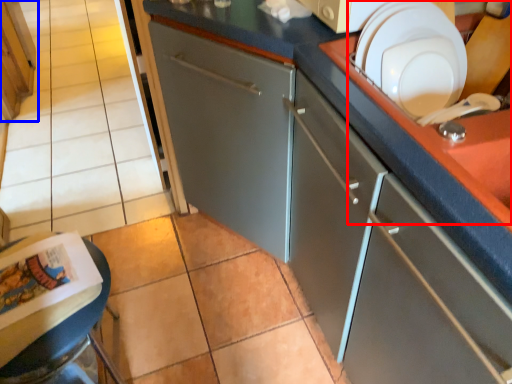
Question: Which point is closer to the camera, sink (highlighted by a red box) or cabinetry (highlighted by a blue box)?

Choices:
 (A) sink
 (B) cabinetry

Answer: (A)